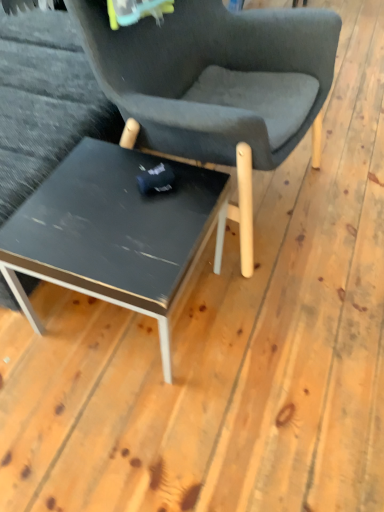
Question: Is matte black table at center in front of or behind matte black chair at center in the image?

Choices:
 (A) front
 (B) behind

Answer: (B)

Question: Considering the positions of matte black table at center and matte black chair at center in the image, is matte black table at center taller or shorter than matte black chair at center?

Choices:
 (A) tall
 (B) short

Answer: (B)

Question: Is point (59, 280) positioned closer to the camera than point (175, 24)?

Choices:
 (A) closer
 (B) farther

Answer: (A)

Question: From the image's perspective, relative to matte black table at center, is matte black chair at center above or below?

Choices:
 (A) below
 (B) above

Answer: (B)

Question: Is matte black chair at center in front of or behind matte black table at center in the image?

Choices:
 (A) front
 (B) behind

Answer: (A)

Question: In terms of height, does matte black chair at center look taller or shorter compared to matte black table at center?

Choices:
 (A) tall
 (B) short

Answer: (A)

Question: Based on their sizes in the image, would you say matte black chair at center is bigger or smaller than matte black table at center?

Choices:
 (A) big
 (B) small

Answer: (A)